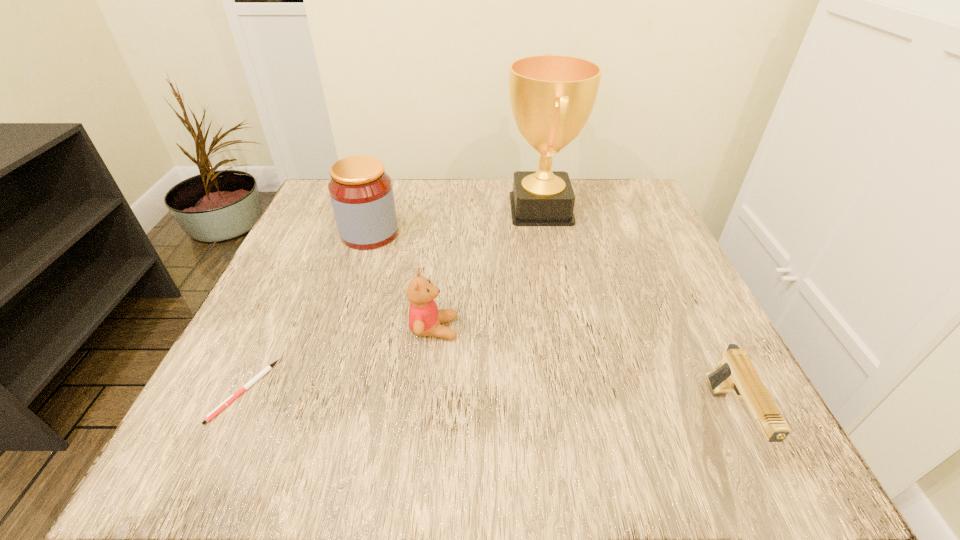
At what (x,y) coordinates should I click in order to perform the action: click on vacant area situated on the front-facing side of the second object from right to left. Please return your answer as a coordinate pair (x, y). The width and height of the screenshot is (960, 540). Looking at the image, I should click on (367, 210).

Where is `vacant space located 0.080m on the front-facing side of the second object from right to left`? vacant space located 0.080m on the front-facing side of the second object from right to left is located at coordinates (469, 210).

Locate an element on the screen. This screenshot has height=540, width=960. vacant area situated 0.400m on the front-facing side of the second object from right to left is located at coordinates (332, 210).

Find the location of a particular element. The width and height of the screenshot is (960, 540). vacant space located 0.100m on the right of the jar is located at coordinates (444, 233).

You are a GUI agent. You are given a task and a screenshot of the screen. Output one action in this format:
    pyautogui.click(x=<x>, y=<y>)
    Task: Click on the vacant space located 0.110m on the front-facing side of the teddy bear
    The height and width of the screenshot is (540, 960).
    Given the screenshot: What is the action you would take?
    pyautogui.click(x=522, y=329)

Locate an element on the screen. The image size is (960, 540). award positioned at the far edge is located at coordinates (552, 96).

Identify the location of jar present at the far edge. Image resolution: width=960 pixels, height=540 pixels. (361, 193).

You are a GUI agent. You are given a task and a screenshot of the screen. Output one action in this format:
    pyautogui.click(x=<x>, y=<y>)
    Task: Click on the pistol that is positioned at the near edge
    
    Given the screenshot: What is the action you would take?
    pyautogui.click(x=736, y=373)

Where is `pen located at the near edge`? pen located at the near edge is located at coordinates (230, 399).

Find the location of a particular element. This screenshot has height=540, width=960. jar that is positioned at the left edge is located at coordinates (361, 193).